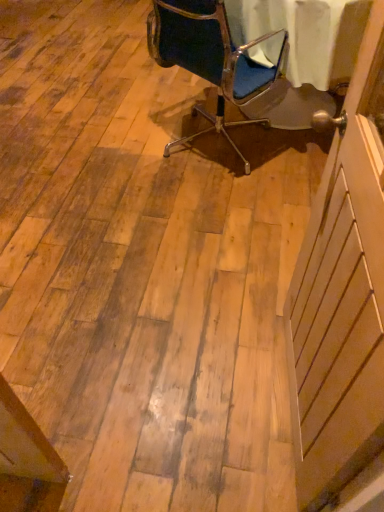
Question: From a real-world perspective, is blue fabric chair at upper center positioned above or below white wood screen door at right?

Choices:
 (A) below
 (B) above

Answer: (A)

Question: Considering the positions of blue fabric chair at upper center and white wood screen door at right in the image, is blue fabric chair at upper center bigger or smaller than white wood screen door at right?

Choices:
 (A) small
 (B) big

Answer: (B)

Question: Is point (190, 49) positioned closer to the camera than point (336, 251)?

Choices:
 (A) closer
 (B) farther

Answer: (B)

Question: From the image's perspective, is white wood screen door at right positioned above or below blue fabric chair at upper center?

Choices:
 (A) below
 (B) above

Answer: (A)

Question: Choose the correct answer: Is white wood screen door at right inside blue fabric chair at upper center or outside it?

Choices:
 (A) inside
 (B) outside

Answer: (B)

Question: Considering the positions of point pos(367,389) and point pos(178,3), is point pos(367,389) closer or farther from the camera than point pos(178,3)?

Choices:
 (A) closer
 (B) farther

Answer: (A)

Question: Is white wood screen door at right wider or thinner than blue fabric chair at upper center?

Choices:
 (A) wide
 (B) thin

Answer: (B)